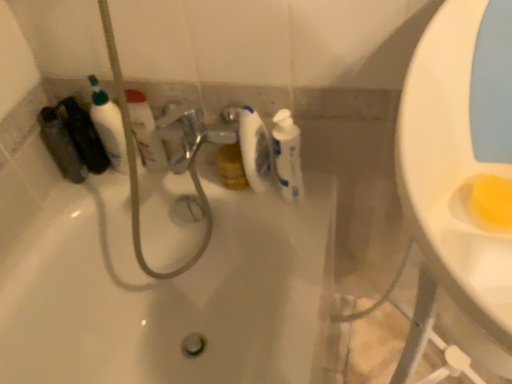
Locate an element on the screen. This screenshot has height=384, width=512. free spot in front of translucent plastic mouthwash at left is located at coordinates (64, 200).